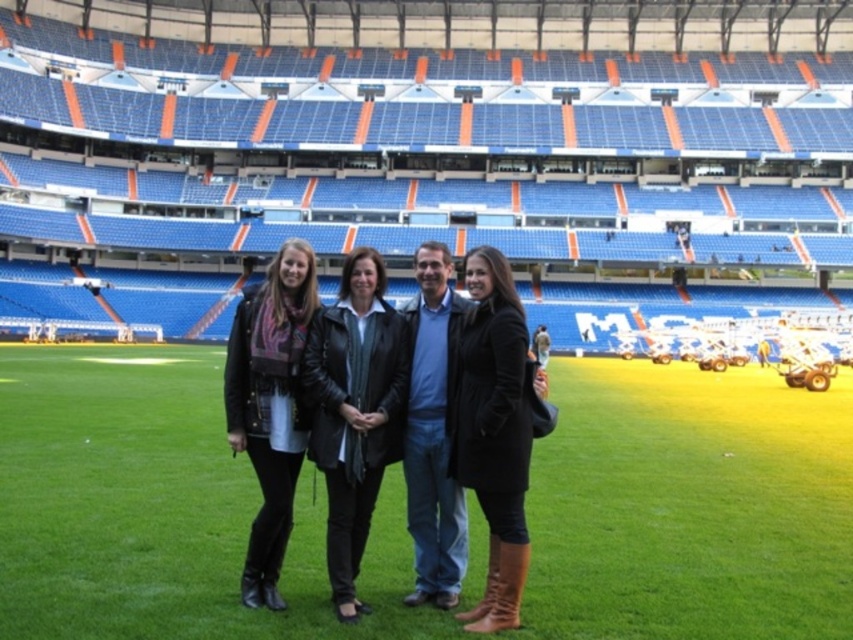
Can you confirm if black leather jacket at center is taller than black leather coat at center?

No.

Does point (332, 308) lie behind point (468, 273)?

No, (332, 308) is in front of (468, 273).

The image size is (853, 640). In order to click on black leather jacket at center in this screenshot , I will do (354, 412).

Is green grass at center bigger than black leather coat at center?

Indeed, green grass at center has a larger size compared to black leather coat at center.

Is point (827, 490) positioned in front of point (486, 429)?

No, (827, 490) is behind (486, 429).

Between point (593, 593) and point (514, 353), which one is positioned behind?

Positioned behind is point (514, 353).

Where is `green grass at center`? This screenshot has width=853, height=640. green grass at center is located at coordinates (689, 506).

Is black leather jacket at center positioned in front of matte black leather jacket at center?

Yes, black leather jacket at center is in front of matte black leather jacket at center.

Between black leather jacket at center and matte black leather jacket at center, which one appears on the left side from the viewer's perspective?

matte black leather jacket at center is more to the left.

The width and height of the screenshot is (853, 640). I want to click on black leather jacket at center, so click(354, 412).